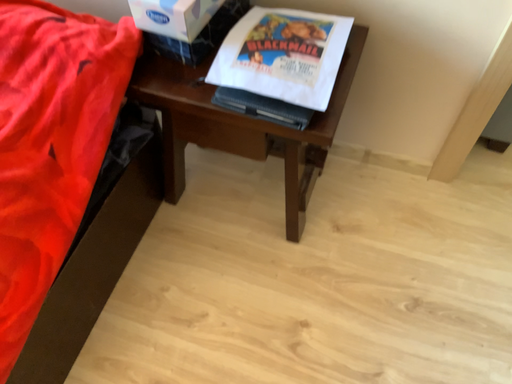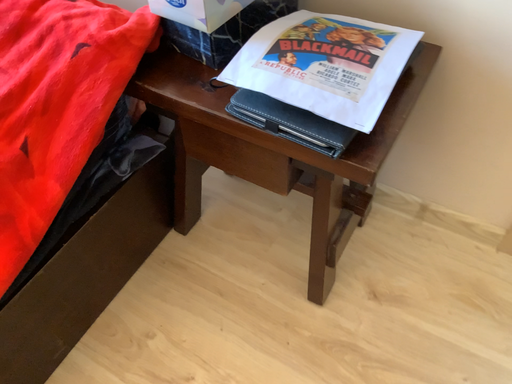
Question: Which way did the camera rotate in the video?

Choices:
 (A) rotated right
 (B) rotated left

Answer: (B)